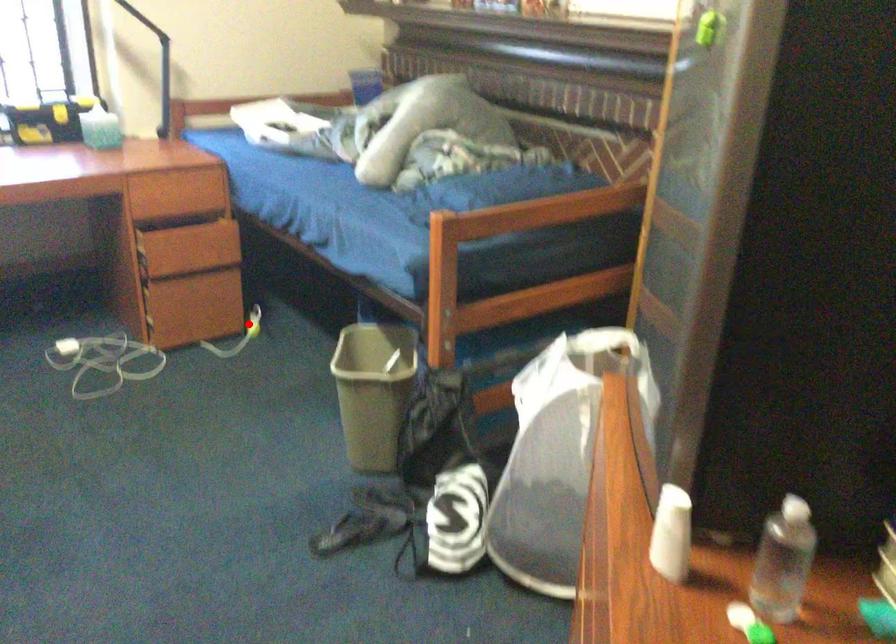
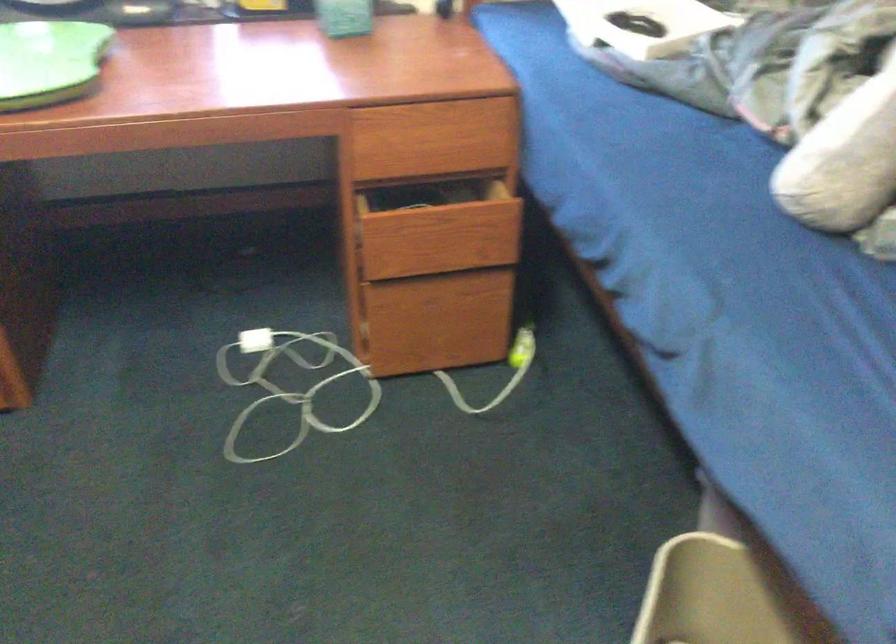
Question: I am providing you with two images of the same scene from different viewpoints. Image1 has a red point marked. In image2, the corresponding 3D location appears at what relative position? Reply with the corresponding letter.

Choices:
 (A) Closer
 (B) Farther

Answer: (A)